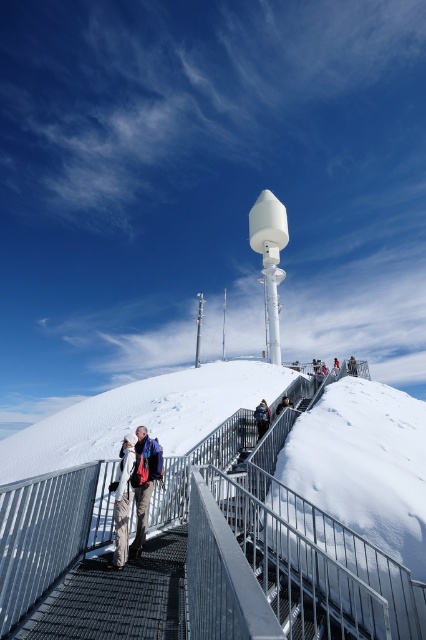
You are standing at the base of the mountain and want to reach the top. There is a metallic mesh stairs at center marked by point (299, 589). Can you see the metallic mesh stairs at center from your current position?

The metallic mesh stairs at center is represented by point (299, 589), so yes, you can see the metallic mesh stairs at center from your current position at the base of the mountain.

You are a hiker planning to reach the top of the mountain. You see two points marked on your map. The first point is at coordinates point [261,536] and the second is at point [124,536]. Which point is closer to the summit?

Point [261,536] is behind point [124,536], so the point [124,536] is closer to the summit.